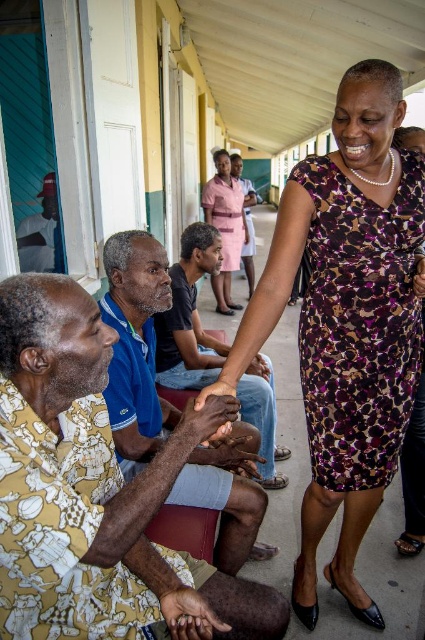
Can you confirm if printed fabric shirt at center is taller than brown leather shoes at center?

No, printed fabric shirt at center is not taller than brown leather shoes at center.

Between point (277, 595) and point (155, 324), which one is positioned behind?

The point (155, 324) is more distant.

Identify the location of printed fabric shirt at center. Image resolution: width=425 pixels, height=640 pixels. (95, 492).

You are a GUI agent. You are given a task and a screenshot of the screen. Output one action in this format:
    pyautogui.click(x=<x>, y=<y>)
    Task: Click on the printed fabric shirt at center
    The image size is (425, 640).
    Given the screenshot: What is the action you would take?
    pyautogui.click(x=95, y=492)

Does purple printed dress at center have a larger size compared to brown leather shoes at center?

Indeed, purple printed dress at center has a larger size compared to brown leather shoes at center.

Can you confirm if purple printed dress at center is positioned to the left of brown leather shoes at center?

In fact, purple printed dress at center is to the right of brown leather shoes at center.

Which is behind, point (354, 205) or point (172, 272)?

The point (172, 272) is more distant.

Locate an element on the screen. This screenshot has width=425, height=640. purple printed dress at center is located at coordinates (346, 321).

Does brown leather shoes at center have a larger size compared to pink fabric dress at center?

No, brown leather shoes at center is not bigger than pink fabric dress at center.

The height and width of the screenshot is (640, 425). What do you see at coordinates (189, 316) in the screenshot?
I see `brown leather shoes at center` at bounding box center [189, 316].

At what (x,y) coordinates should I click in order to perform the action: click on brown leather shoes at center. Please return your answer as a coordinate pair (x, y). This screenshot has width=425, height=640. Looking at the image, I should click on point(189,316).